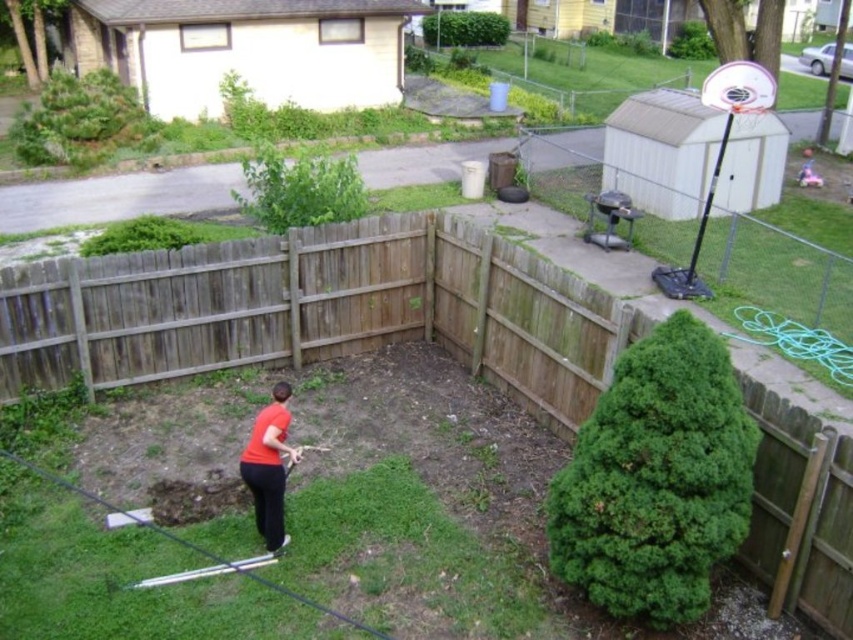
Question: Which of these objects is positioned farthest from the weathered wood fence at center?

Choices:
 (A) white plastic basketball hoop at upper right
 (B) matte orange shirt at lower left

Answer: (A)

Question: Which object is positioned closest to the matte orange shirt at lower left?

Choices:
 (A) white plastic basketball hoop at upper right
 (B) brown wood fence at center

Answer: (B)

Question: Is the position of brown wood fence at center more distant than that of weathered wood fence at center?

Choices:
 (A) no
 (B) yes

Answer: (A)

Question: Does brown wood fence at center lie behind matte orange shirt at lower left?

Choices:
 (A) yes
 (B) no

Answer: (B)

Question: Can you confirm if weathered wood fence at center is positioned to the left of white plastic basketball hoop at upper right?

Choices:
 (A) yes
 (B) no

Answer: (A)

Question: Which point is closer to the camera taking this photo?

Choices:
 (A) (718, 164)
 (B) (338, 304)
 (C) (270, 252)
 (D) (276, 422)

Answer: (D)